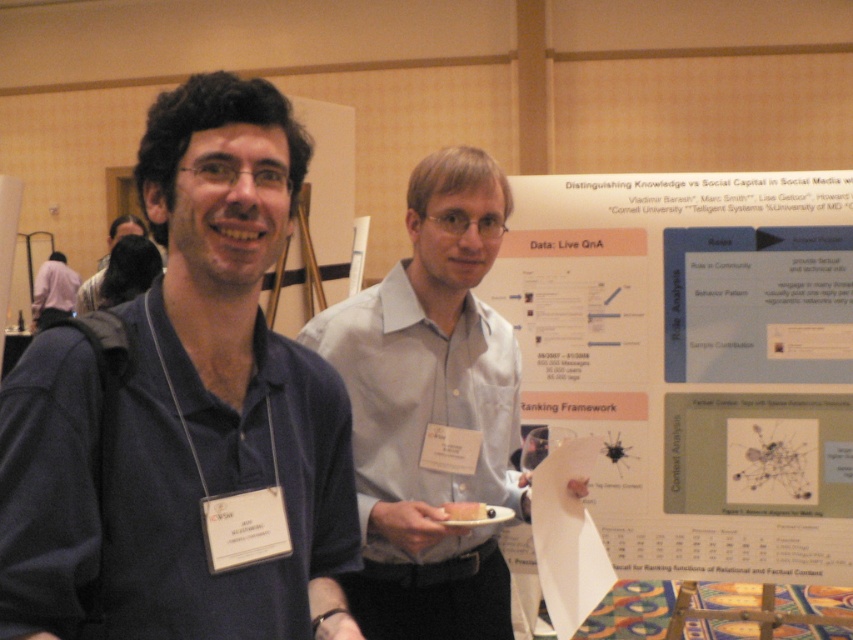
Question: Is white shirt at center closer to camera compared to matte black shirt at left?

Choices:
 (A) no
 (B) yes

Answer: (B)

Question: Does matte blue shirt at center appear on the left side of white shirt at center?

Choices:
 (A) no
 (B) yes

Answer: (B)

Question: Which of these objects is positioned farthest from the white shirt at center?

Choices:
 (A) matte black shirt at left
 (B) matte blue shirt at center

Answer: (A)

Question: Based on their relative distances, which object is nearer to the matte blue shirt at center?

Choices:
 (A) matte black shirt at left
 (B) white shirt at center
 (C) white paper at right

Answer: (B)

Question: Can you confirm if white paper at right is wider than matte black shirt at left?

Choices:
 (A) no
 (B) yes

Answer: (B)

Question: Which of these objects is positioned farthest from the white paper at right?

Choices:
 (A) white shirt at center
 (B) matte blue shirt at center
 (C) matte black shirt at left

Answer: (C)